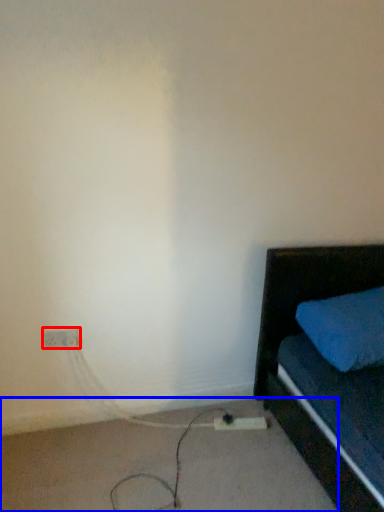
Question: Which point is further to the camera, electric outlet (highlighted by a red box) or concrete (highlighted by a blue box)?

Choices:
 (A) electric outlet
 (B) concrete

Answer: (A)